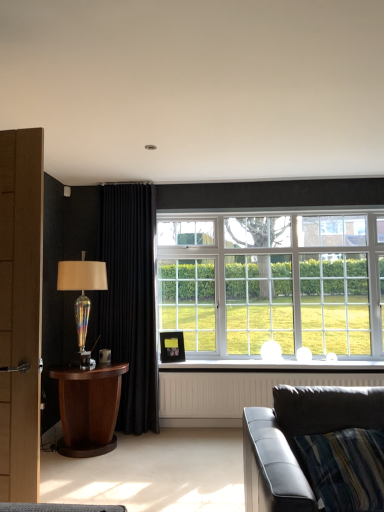
Where is `vacant area that lies to the right of matte black picture frame at center`? The height and width of the screenshot is (512, 384). vacant area that lies to the right of matte black picture frame at center is located at coordinates (199, 360).